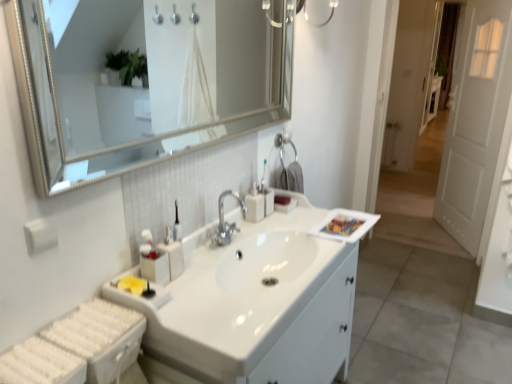
Question: Considering their positions, is beige plastic soap dispenser at center located in front of or behind white glossy sink at center?

Choices:
 (A) front
 (B) behind

Answer: (B)

Question: From the image's perspective, is beige plastic soap dispenser at center positioned above or below white glossy sink at center?

Choices:
 (A) above
 (B) below

Answer: (A)

Question: Which is nearer to the satin silver soap dispenser at center?

Choices:
 (A) white glossy sink at center
 (B) beige plastic soap dispenser at center
 (C) silver/metallic mirror at upper center
 (D) white wooden door at right

Answer: (B)

Question: Which object is the farthest from the white glossy sink at center?

Choices:
 (A) white wooden door at right
 (B) beige plastic soap dispenser at center
 (C) silver/metallic mirror at upper center
 (D) satin silver soap dispenser at center

Answer: (C)